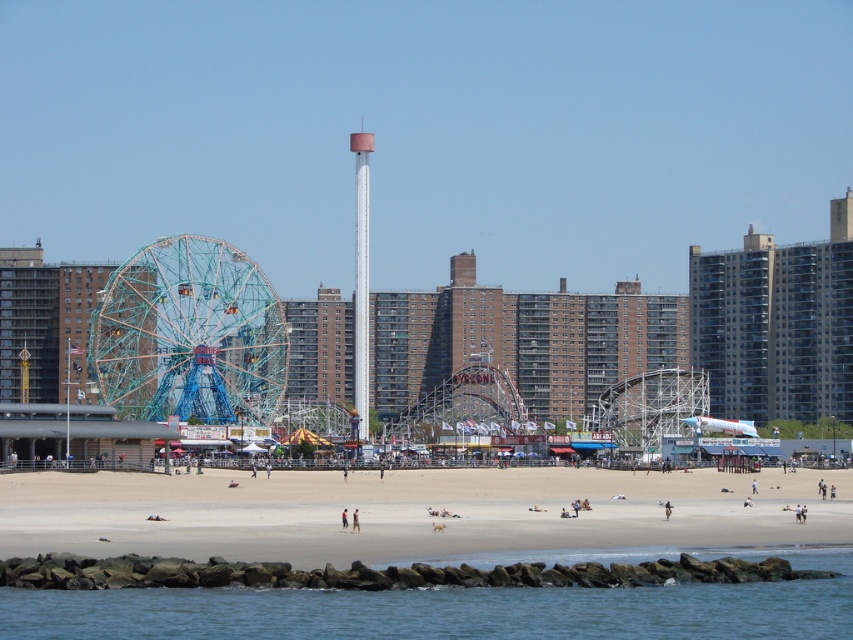
Where is `beige sand beach at center`? This screenshot has height=640, width=853. beige sand beach at center is located at coordinates (410, 513).

Who is shorter, beige sand beach at center or blue water at lower center?

blue water at lower center is shorter.

Is point (512, 497) positioned before point (364, 605)?

No, (512, 497) is behind (364, 605).

Identify the location of beige sand beach at center. (410, 513).

Who is shorter, blue water at lower center or teal metallic ferris wheel at center-left?

Standing shorter between the two is blue water at lower center.

Between blue water at lower center and teal metallic ferris wheel at center-left, which one appears on the left side from the viewer's perspective?

teal metallic ferris wheel at center-left

Does point (798, 600) come behind point (283, 369)?

No.

I want to click on blue water at lower center, so click(x=437, y=611).

Is blue water at lower center above white smooth tower at center?

No, blue water at lower center is not above white smooth tower at center.

Is point (636, 612) positioned in front of point (358, 397)?

Yes, point (636, 612) is closer to viewer.

You are a GUI agent. You are given a task and a screenshot of the screen. Output one action in this format:
    pyautogui.click(x=<x>, y=<y>)
    Task: Click on the blue water at lower center
    The height and width of the screenshot is (640, 853).
    Given the screenshot: What is the action you would take?
    pyautogui.click(x=437, y=611)

At what (x,y) coordinates should I click in order to perform the action: click on blue water at lower center. Please return your answer as a coordinate pair (x, y). Looking at the image, I should click on (437, 611).